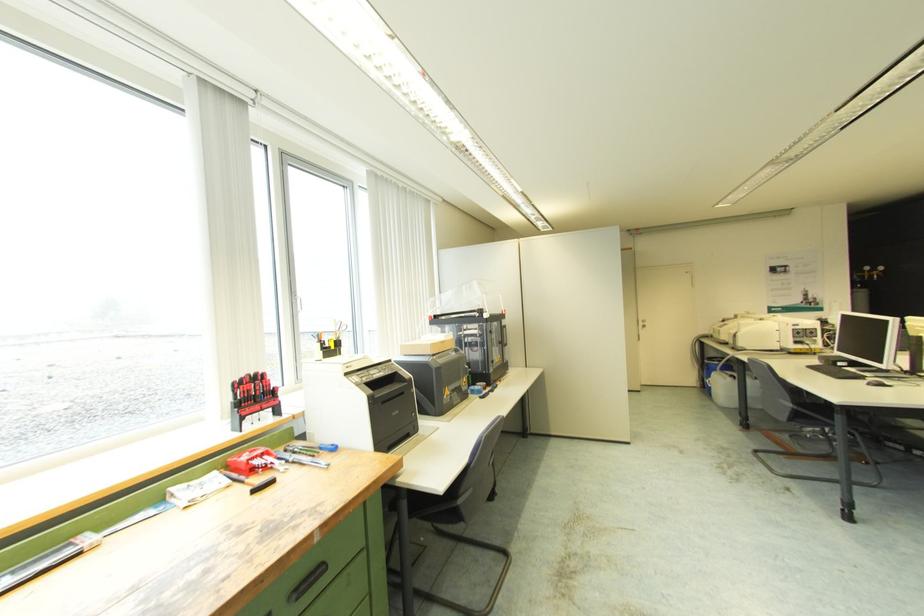
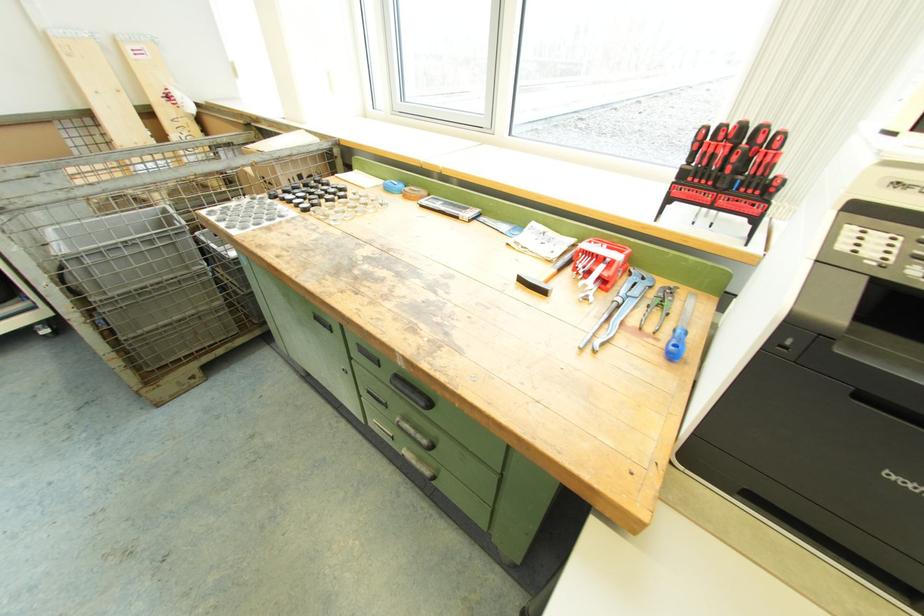
Where in the second image is the point corresponding to (358,382) from the first image?

(847, 246)